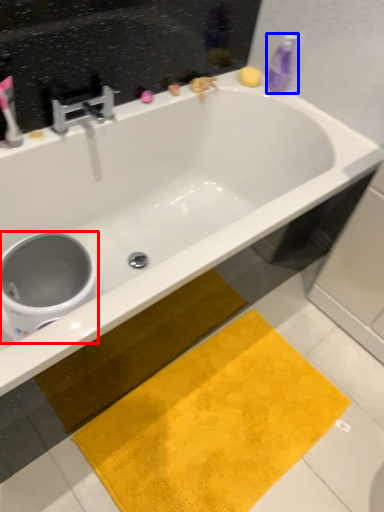
Question: Which object is closer to the camera taking this photo, toilet bowl (highlighted by a red box) or cleaning product (highlighted by a blue box)?

Choices:
 (A) toilet bowl
 (B) cleaning product

Answer: (A)